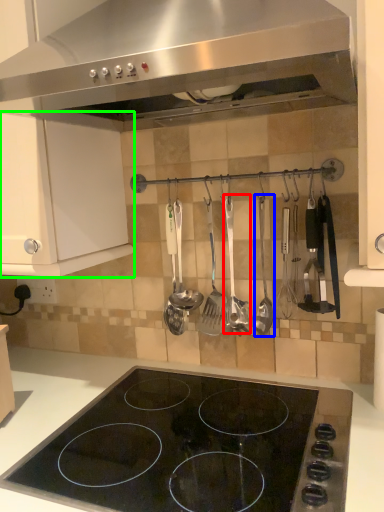
Question: Which is farther away from silverware (highlighted by a red box)? silverware (highlighted by a blue box) or cabinetry (highlighted by a green box)?

Choices:
 (A) silverware
 (B) cabinetry

Answer: (B)